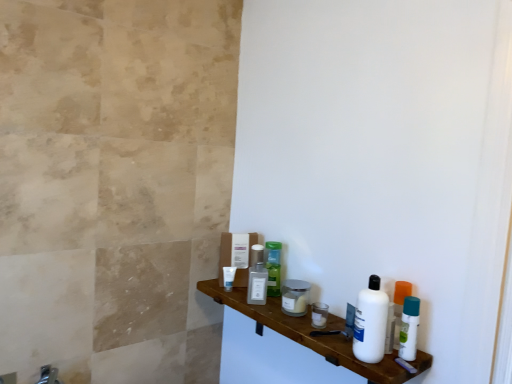
Question: Is white plastic bottle at right next to white plastic bottle at right, which appears as the second mouthwash when viewed from the back?

Choices:
 (A) no
 (B) yes

Answer: (B)

Question: Are white plastic bottle at right and white plastic bottle at right, which appears as the first mouthwash when viewed from the right, far apart?

Choices:
 (A) yes
 (B) no

Answer: (B)

Question: Is white plastic bottle at right at the right side of white plastic bottle at right, acting as the second mouthwash starting from the left?

Choices:
 (A) yes
 (B) no

Answer: (B)

Question: From the image's perspective, is white plastic bottle at right on top of white plastic bottle at right, acting as the second mouthwash starting from the left?

Choices:
 (A) yes
 (B) no

Answer: (A)

Question: Considering the relative sizes of white plastic bottle at right and white plastic bottle at right, arranged as the 1th mouthwash when viewed from the front, in the image provided, is white plastic bottle at right taller than white plastic bottle at right, arranged as the 1th mouthwash when viewed from the front,?

Choices:
 (A) yes
 (B) no

Answer: (A)

Question: Can you confirm if white plastic bottle at right is wider than white plastic bottle at right, arranged as the 1th mouthwash when viewed from the front?

Choices:
 (A) yes
 (B) no

Answer: (A)

Question: Can you confirm if white plastic bottle at right, which appears as the second mouthwash when viewed from the back, is smaller than white glossy wood shelf at lower right?

Choices:
 (A) no
 (B) yes

Answer: (B)

Question: Can you see white plastic bottle at right, acting as the second mouthwash starting from the left, touching white glossy wood shelf at lower right?

Choices:
 (A) yes
 (B) no

Answer: (B)

Question: Is white glossy wood shelf at lower right a part of white plastic bottle at right, acting as the second mouthwash starting from the left?

Choices:
 (A) no
 (B) yes

Answer: (A)

Question: Is white plastic bottle at right, arranged as the 1th mouthwash when viewed from the front, to the right of white glossy wood shelf at lower right from the viewer's perspective?

Choices:
 (A) yes
 (B) no

Answer: (A)

Question: Does white plastic bottle at right, arranged as the 1th mouthwash when viewed from the front, have a greater width compared to white glossy wood shelf at lower right?

Choices:
 (A) no
 (B) yes

Answer: (A)

Question: Can you confirm if white plastic bottle at right, which appears as the second mouthwash when viewed from the back, is positioned to the left of white glossy wood shelf at lower right?

Choices:
 (A) no
 (B) yes

Answer: (A)

Question: Does white matte tube at center, which appears as the 1th toiletry when viewed from the left, have a larger size compared to white plastic bottle at right, arranged as the 1th mouthwash when viewed from the front?

Choices:
 (A) no
 (B) yes

Answer: (A)